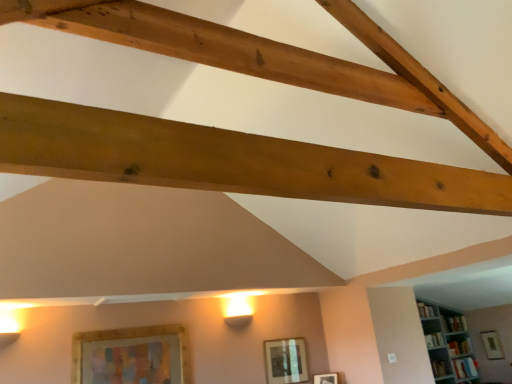
Question: From a real-world perspective, is white wooden bookshelf at upper right physically above matte silver picture frame at center, the 2th picture frame when ordered from front to back?

Choices:
 (A) yes
 (B) no

Answer: (B)

Question: From a real-world perspective, is white wooden bookshelf at upper right below matte silver picture frame at center, the 2th picture frame when ordered from front to back?

Choices:
 (A) yes
 (B) no

Answer: (A)

Question: Is white wooden bookshelf at upper right positioned before matte silver picture frame at center, the 2th picture frame when ordered from front to back?

Choices:
 (A) yes
 (B) no

Answer: (B)

Question: Does white wooden bookshelf at upper right have a larger size compared to matte silver picture frame at center, acting as the 3th picture frame starting from the back?

Choices:
 (A) no
 (B) yes

Answer: (B)

Question: Could you tell me if white wooden bookshelf at upper right is turned towards matte silver picture frame at center, the 2th picture frame when ordered from front to back?

Choices:
 (A) yes
 (B) no

Answer: (B)

Question: Based on their sizes in the image, would you say wooden framed picture at lower left, which appears as the first picture frame when viewed from the front, is bigger or smaller than natural wood beam at upper center?

Choices:
 (A) big
 (B) small

Answer: (B)

Question: From a real-world perspective, is wooden framed picture at lower left, the fourth picture frame viewed from the back, above or below natural wood beam at upper center?

Choices:
 (A) below
 (B) above

Answer: (A)

Question: Is wooden framed picture at lower left, which is the first picture frame from left to right, wider or thinner than natural wood beam at upper center?

Choices:
 (A) wide
 (B) thin

Answer: (B)

Question: Is point click(x=155, y=337) positioned closer to the camera than point click(x=234, y=175)?

Choices:
 (A) farther
 (B) closer

Answer: (A)

Question: In terms of width, does matte wooden picture frame at center, which ranks as the 2th picture frame in right-to-left order, look wider or thinner when compared to wooden picture frame at upper center, the 1th picture frame when ordered from right to left?

Choices:
 (A) wide
 (B) thin

Answer: (A)

Question: Based on their sizes in the image, would you say matte wooden picture frame at center, placed as the third picture frame when sorted from left to right, is bigger or smaller than wooden picture frame at upper center, the fourth picture frame when ordered from top to bottom?

Choices:
 (A) big
 (B) small

Answer: (B)

Question: From the image's perspective, is matte wooden picture frame at center, marked as the 2th picture frame in a bottom-to-top arrangement, located above or below wooden picture frame at upper center, the fourth picture frame in the left-to-right sequence?

Choices:
 (A) below
 (B) above

Answer: (B)

Question: Is matte wooden picture frame at center, the 3th picture frame positioned from the front, taller or shorter than wooden picture frame at upper center, which is counted as the 4th picture frame, starting from the front?

Choices:
 (A) tall
 (B) short

Answer: (B)

Question: From a real-world perspective, is white wooden bookshelf at upper right positioned above or below wooden framed picture at lower left, acting as the first picture frame starting from the top?

Choices:
 (A) above
 (B) below

Answer: (B)

Question: Considering the positions of white wooden bookshelf at upper right and wooden framed picture at lower left, the fourth picture frame positioned from the right, in the image, is white wooden bookshelf at upper right bigger or smaller than wooden framed picture at lower left, the fourth picture frame positioned from the right,?

Choices:
 (A) small
 (B) big

Answer: (B)